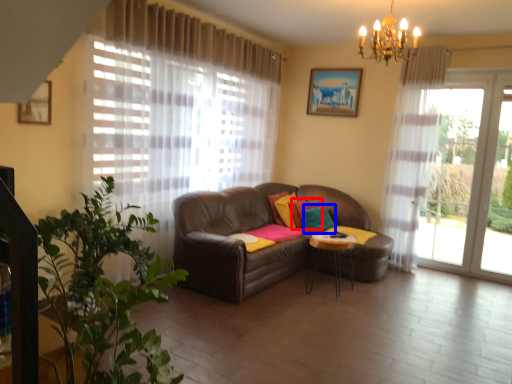
Question: Which of the following is the farthest to the observer, pillow (highlighted by a red box) or pillow (highlighted by a blue box)?

Choices:
 (A) pillow
 (B) pillow

Answer: (A)